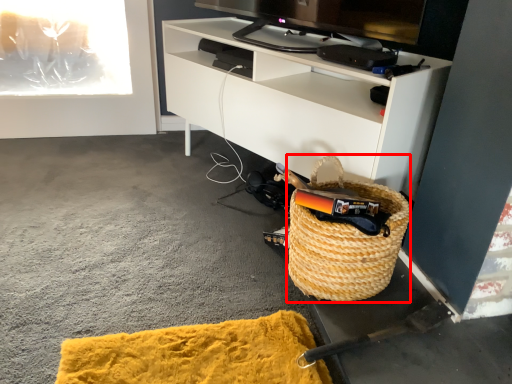
Question: From the image's perspective, where is picnic basket (annotated by the red box) located in relation to cabinetry in the image?

Choices:
 (A) above
 (B) below

Answer: (B)